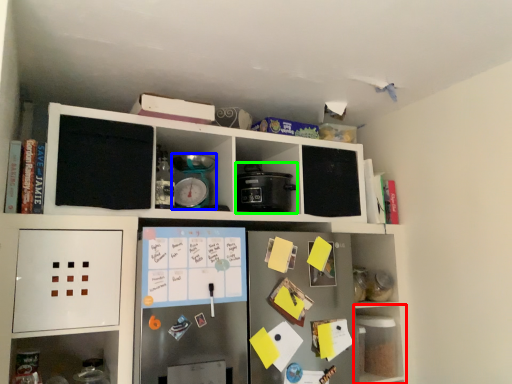
Question: Considering the real-world distances, which object is farthest from shelf (highlighted by a red box)? appliance (highlighted by a blue box) or appliance (highlighted by a green box)?

Choices:
 (A) appliance
 (B) appliance

Answer: (A)